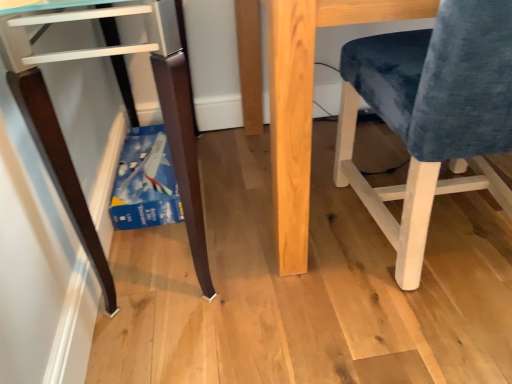
Question: From their relative heights in the image, would you say natural wood table at center is taller or shorter than velvet blue chair at right?

Choices:
 (A) tall
 (B) short

Answer: (B)

Question: Considering the positions of point (369, 6) and point (416, 278), is point (369, 6) closer or farther from the camera than point (416, 278)?

Choices:
 (A) closer
 (B) farther

Answer: (A)

Question: Which object is the closest to the natural wood table at center?

Choices:
 (A) matte dark wood desk at lower left
 (B) velvet blue chair at right

Answer: (B)

Question: Which of these objects is positioned closest to the matte dark wood desk at lower left?

Choices:
 (A) velvet blue chair at right
 (B) natural wood table at center

Answer: (B)